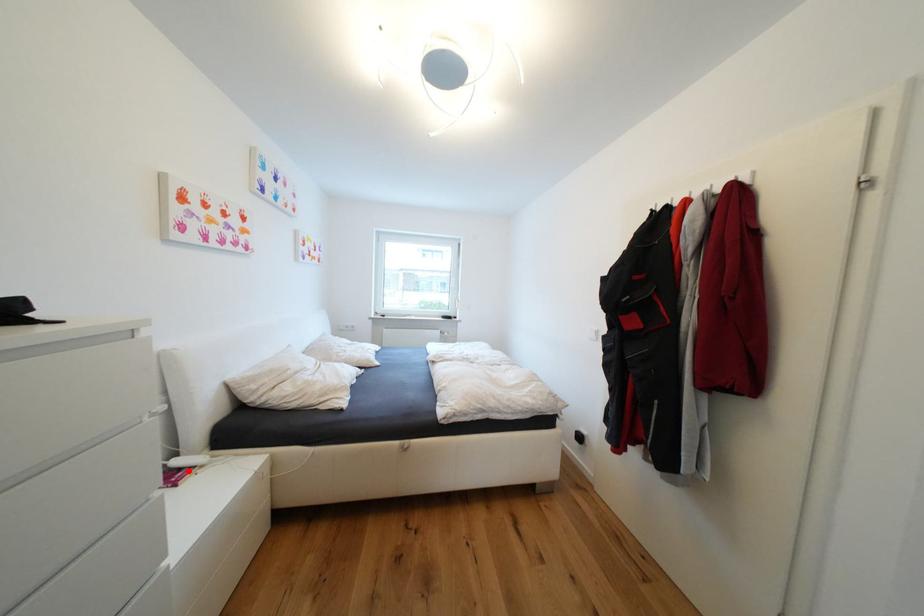
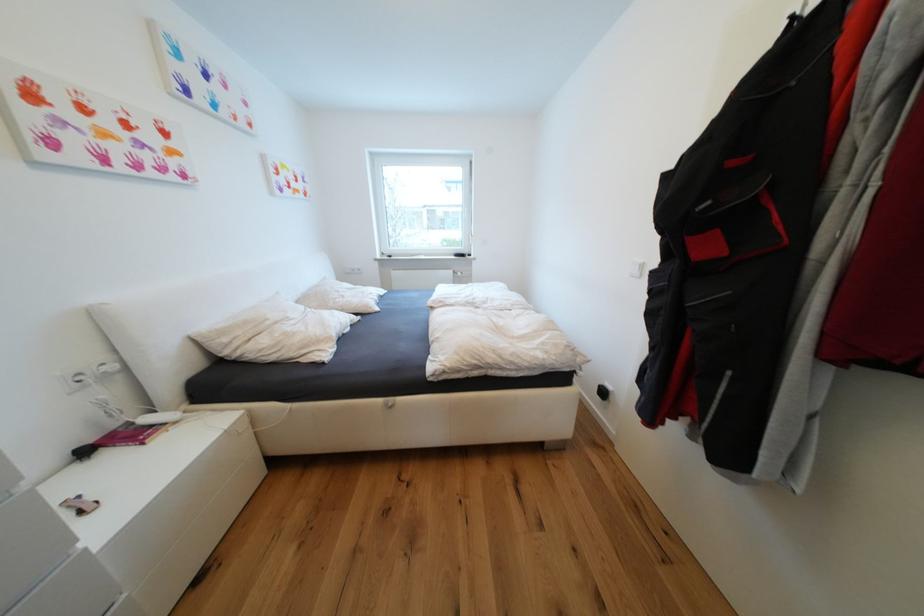
Where in the second image is the point corresponding to the highlighted location from the first image?

(159, 428)